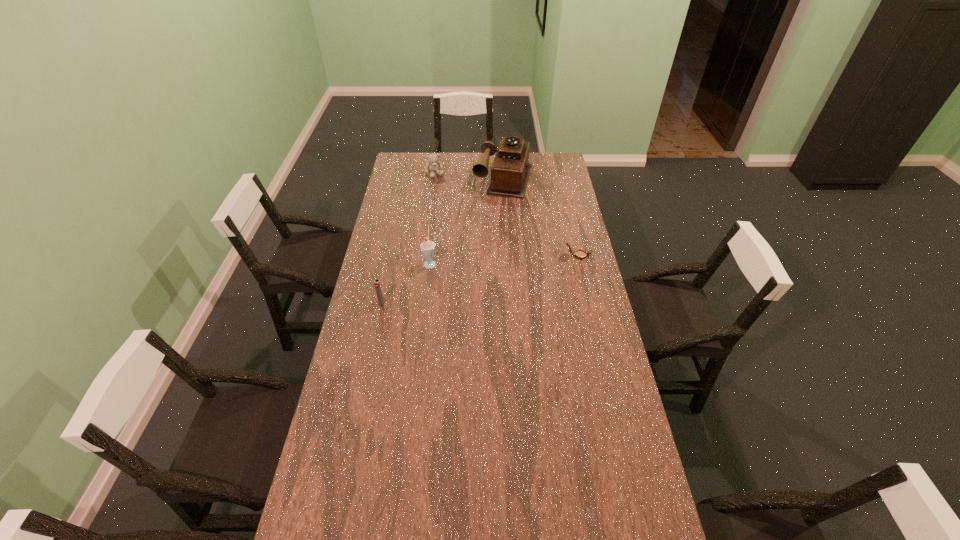
You are a GUI agent. You are given a task and a screenshot of the screen. Output one action in this format:
    pyautogui.click(x=<x>, y=<y>)
    Task: Click on the object positioned at the left edge
    This screenshot has width=960, height=540.
    Given the screenshot: What is the action you would take?
    pyautogui.click(x=377, y=285)

In order to click on object located in the right edge section of the desktop in this screenshot , I will do `click(579, 254)`.

Image resolution: width=960 pixels, height=540 pixels. Find the location of `vacant space at the left edge of the desktop`. vacant space at the left edge of the desktop is located at coordinates (357, 349).

What are the coordinates of `vacant point at the right edge` in the screenshot? It's located at (578, 412).

At what (x,y) coordinates should I click in order to perform the action: click on free space at the near left corner. Please return your answer as a coordinate pair (x, y). The height and width of the screenshot is (540, 960). Looking at the image, I should click on (304, 535).

Find the location of a particular element. This screenshot has height=540, width=960. vacant space that's between the rightmost object and the tallest object is located at coordinates (540, 217).

At what (x,y) coordinates should I click in order to perform the action: click on blank region between the fourth object from left to right and the milkshake. Please return your answer as a coordinate pair (x, y). Looking at the image, I should click on (467, 220).

You are a GUI agent. You are given a task and a screenshot of the screen. Output one action in this format:
    pyautogui.click(x=<x>, y=<y>)
    Task: Click on the vacant space that is in between the teddy bear and the tallest object
    The width and height of the screenshot is (960, 540).
    Given the screenshot: What is the action you would take?
    pyautogui.click(x=469, y=176)

At what (x,y) coordinates should I click in order to perform the action: click on free point between the compass and the teddy bear. Please return your answer as a coordinate pair (x, y). The height and width of the screenshot is (540, 960). Looking at the image, I should click on (506, 214).

Locate an element on the screen. The image size is (960, 540). free area in between the teddy bear and the compass is located at coordinates (506, 214).